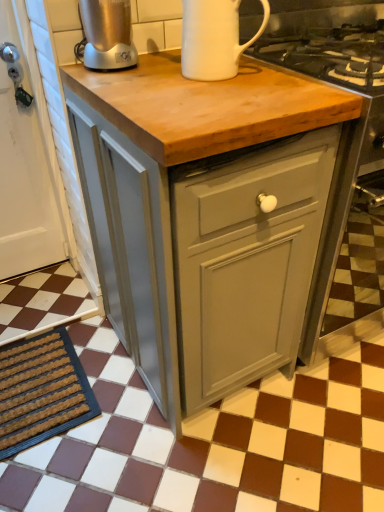
Question: Is brown textured mat at lower left taller or shorter than matte gray cabinet at center?

Choices:
 (A) short
 (B) tall

Answer: (A)

Question: Is brown textured mat at lower left bigger or smaller than matte gray cabinet at center?

Choices:
 (A) big
 (B) small

Answer: (B)

Question: Which of these objects is positioned farthest from the brushed metal blender at upper left, the second kitchen appliance from the right?

Choices:
 (A) matte gray cabinet at center
 (B) white ceramic mug at upper center, the first kitchen appliance from the right
 (C) brown checkered tile at center
 (D) brown textured mat at lower left
 (E) matte gray cabinet at center

Answer: (C)

Question: Which of these objects is positioned farthest from the brown checkered tile at center?

Choices:
 (A) brushed metal blender at upper left, the second kitchen appliance from the right
 (B) matte gray cabinet at center
 (C) white ceramic mug at upper center, the 2th kitchen appliance when ordered from left to right
 (D) matte gray cabinet at center
 (E) brown textured mat at lower left

Answer: (A)